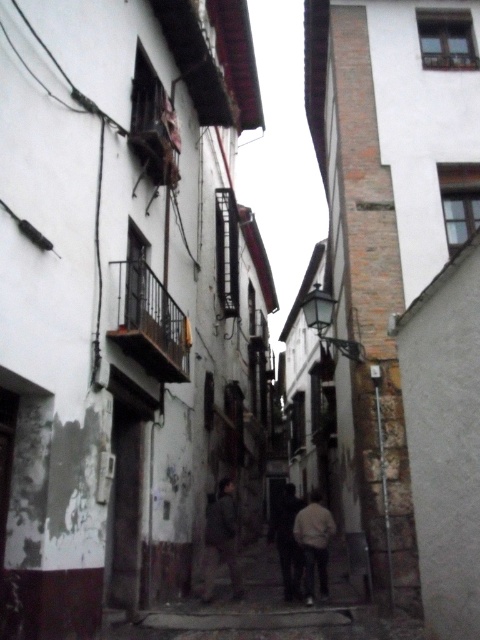
Question: Is light beige fabric jacket at center to the left of dark gray fabric pants at center from the viewer's perspective?

Choices:
 (A) no
 (B) yes

Answer: (A)

Question: Is dark gray fabric jacket at center thinner than light beige fabric jacket at center?

Choices:
 (A) yes
 (B) no

Answer: (A)

Question: Which of these objects is positioned farthest from the dark gray fabric couple at center?

Choices:
 (A) dark gray fabric jacket at center
 (B) light beige fabric jacket at center
 (C) dark gray fabric pants at center

Answer: (C)

Question: Which point is farther from the camera taking this photo?

Choices:
 (A) (297, 561)
 (B) (321, 545)

Answer: (A)

Question: Which of the following is the closest to the observer?

Choices:
 (A) (294, 515)
 (B) (311, 529)

Answer: (B)

Question: Can you confirm if dark gray fabric couple at center is thinner than dark gray fabric jacket at center?

Choices:
 (A) no
 (B) yes

Answer: (B)